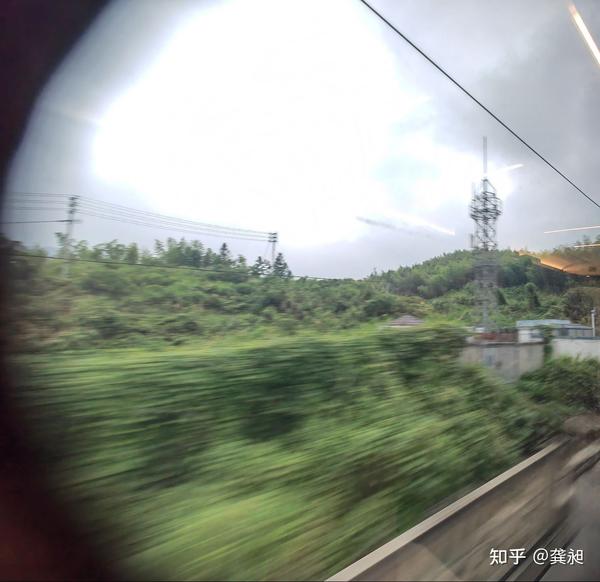
Find the location of a particular element. cable is located at coordinates (420, 49), (107, 202), (101, 204), (100, 209), (92, 209), (98, 212), (95, 216), (50, 221), (49, 257).